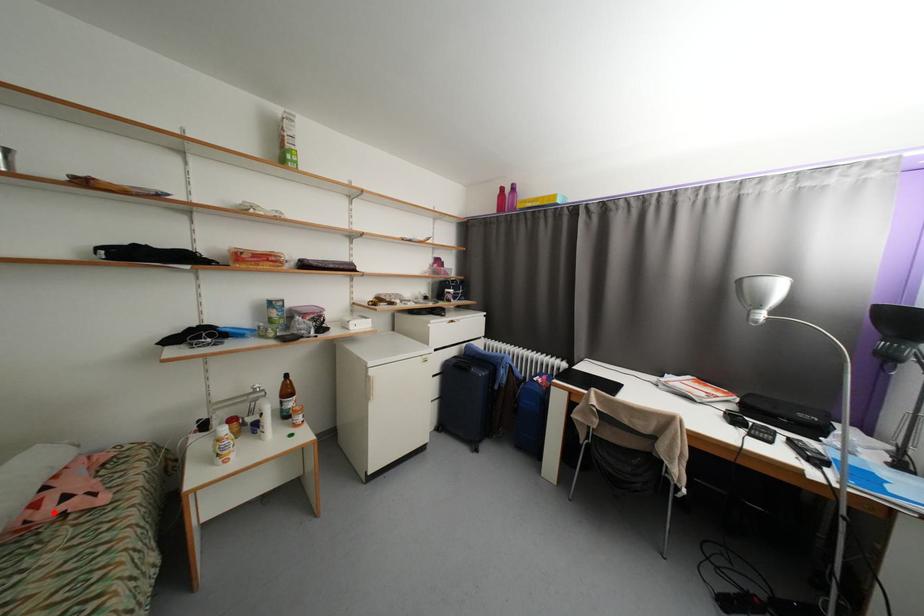
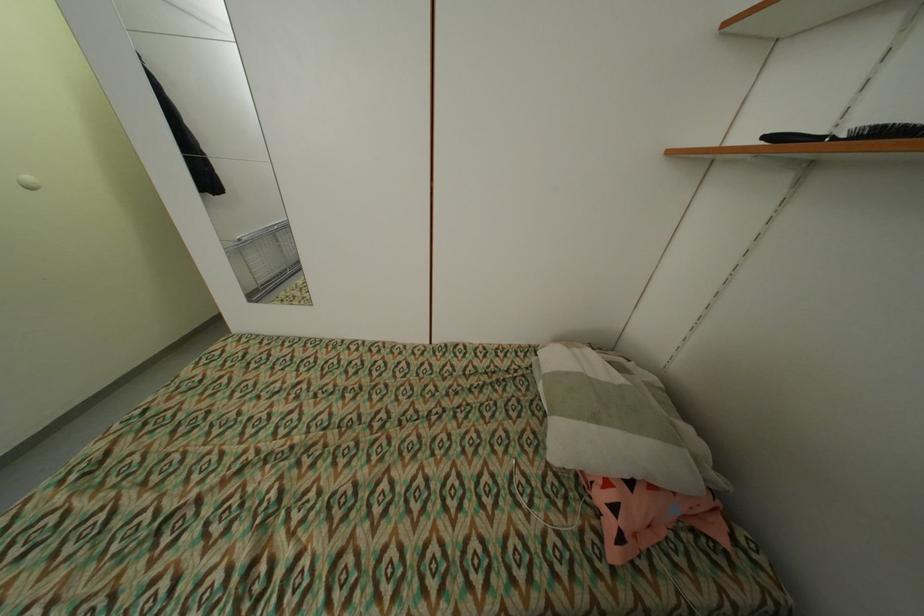
Question: I am providing you with two images of the same scene from different viewpoints. A red point is shown in image1. For the corresponding object point in image2, is it positioned nearer or farther from the camera?

Choices:
 (A) Nearer
 (B) Farther

Answer: (B)